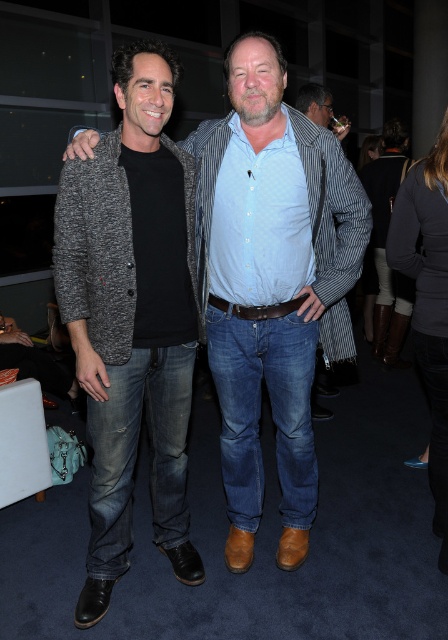
You are a photographer trying to capture a closeup of the matte gray sweater at center. Based on the scene description, where should you position your camera to ensure the sweater is in focus?

The matte gray sweater at center is located at point 0.444 on the x axis and 0.607 on the y axis, so position the camera directly facing that coordinate to ensure the sweater is in focus.

You are organizing a clothing display and need to place a new item between the matte gray sweater at center and the matte gray cardigan at center. Since the sweater is to the right of the cardigan, where should you position the new item to maintain symmetry?

The new item should be placed to the left of the matte gray sweater at center and to the right of the matte gray cardigan at center to maintain symmetry between them.

You are organizing a photoshoot and need to adjust lighting to ensure both the matte gray sweater at center and the matte gray cardigan at center are clearly visible. Given their positions, which one might require more focused lighting adjustments?

The matte gray sweater at center requires more focused lighting adjustments because it is in front of the matte gray cardigan at center, and might be in a brighter area due to the foreground being more lit.